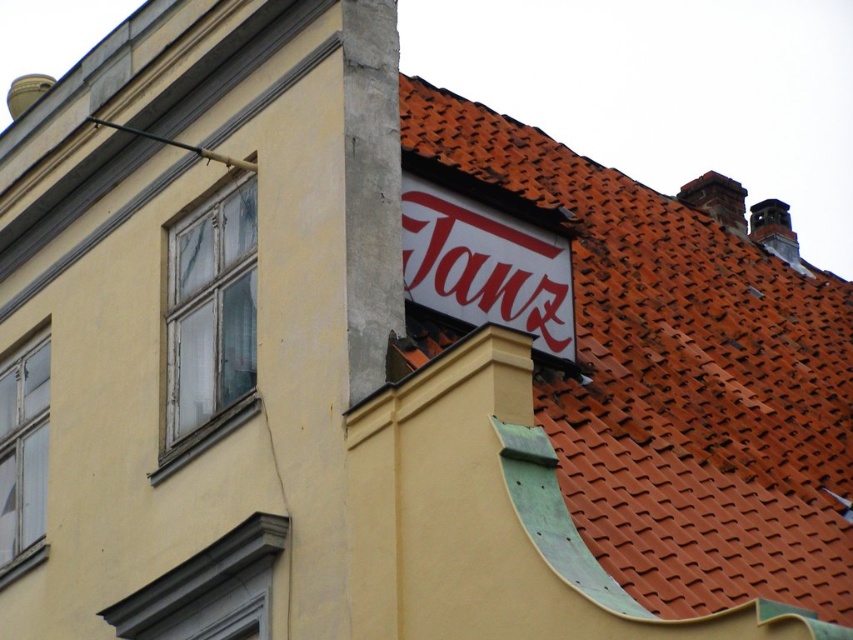
You are an architect inspecting the building. You notice the white wooden window at upper left and the smooth gray window frame at lower left. Which of these has a smaller width?

The white wooden window at upper left has a smaller width than the smooth gray window frame at lower left because it is thinner.

You are standing in front of the building and notice the white matte sign at upper center and the clear glass window at lower left. Which object is closer to you from your current viewpoint?

The white matte sign at upper center is closer to you because it is in front of the clear glass window at lower left.

You are standing in front of the building and want to see both the white matte sign at upper center and the smooth gray window frame at lower left. Which object is higher up in the image?

The white matte sign at upper center is located above the smooth gray window frame at lower left, so it is higher up in the image.